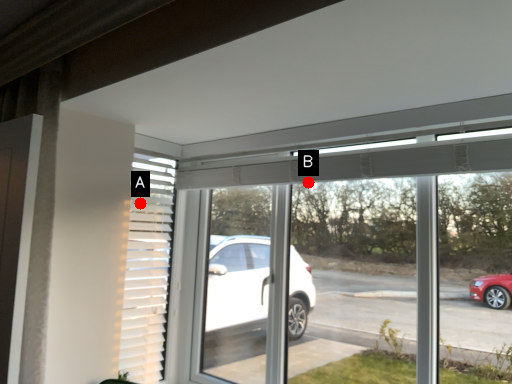
Question: Two points are circled on the image, labeled by A and B beside each circle. Which of the following is the closest to the observer?

Choices:
 (A) A is closer
 (B) B is closer

Answer: (B)